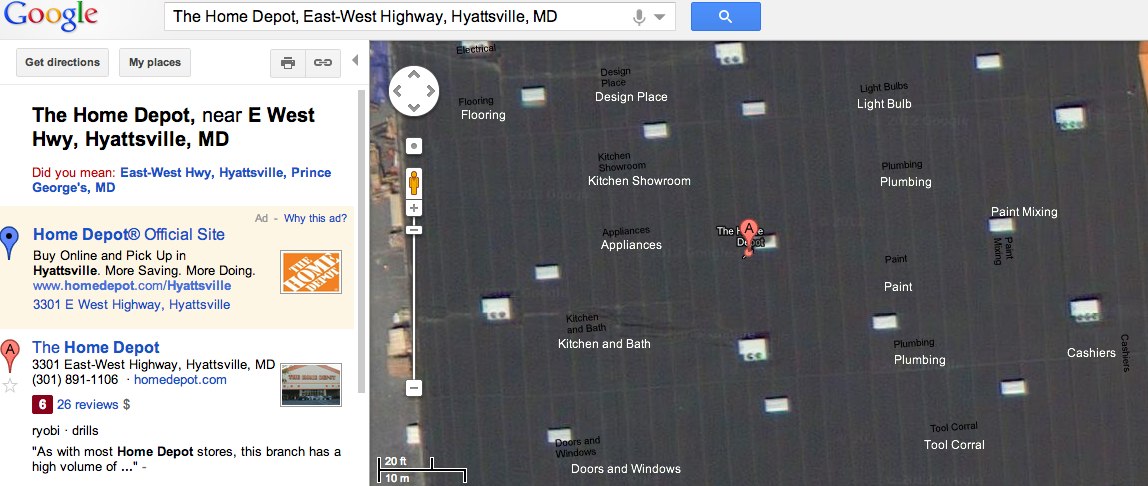
Locate an element on the screen. Image resolution: width=1148 pixels, height=486 pixels. doors (text) is located at coordinates (594, 471).